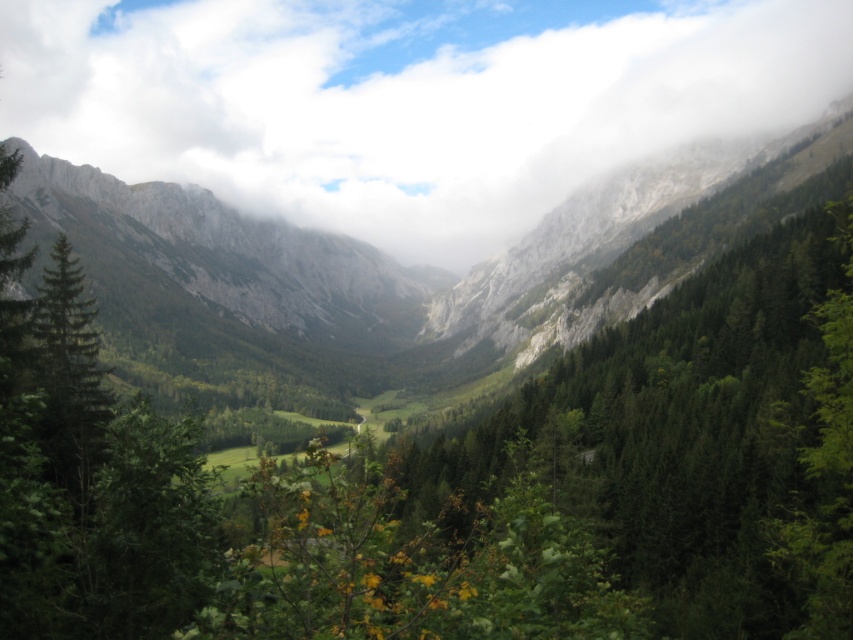
Question: Does green matte forest at center have a lesser width compared to rugged stone mountain at left?

Choices:
 (A) no
 (B) yes

Answer: (B)

Question: Which point is closer to the camera taking this photo?

Choices:
 (A) (421, 513)
 (B) (202, 209)
 (C) (548, 157)

Answer: (A)

Question: Does green matte forest at center appear under rugged stone mountain at left?

Choices:
 (A) no
 (B) yes

Answer: (B)

Question: Which object is farther from the camera taking this photo?

Choices:
 (A) green matte forest at center
 (B) rugged stone mountain at left

Answer: (B)

Question: Estimate the real-world distances between objects in this image. Which object is closer to the rugged stone mountain at left?

Choices:
 (A) white fluffy cloud at center
 (B) green matte forest at center

Answer: (A)

Question: Does white fluffy cloud at center appear on the right side of green matte forest at center?

Choices:
 (A) yes
 (B) no

Answer: (B)